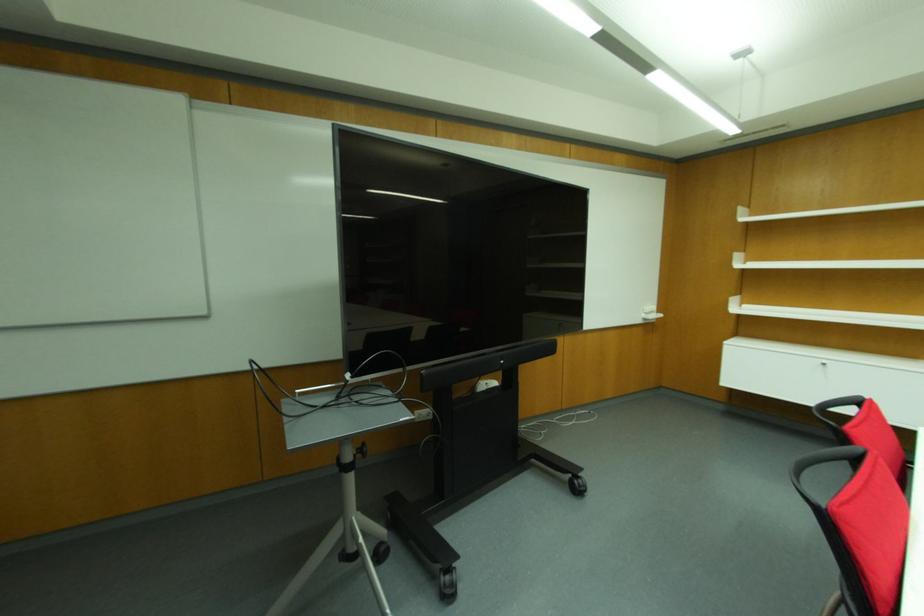
Find where to insert the silver cabinet lock. Please return your answer as a coordinate pair (x, y).

(822, 363)